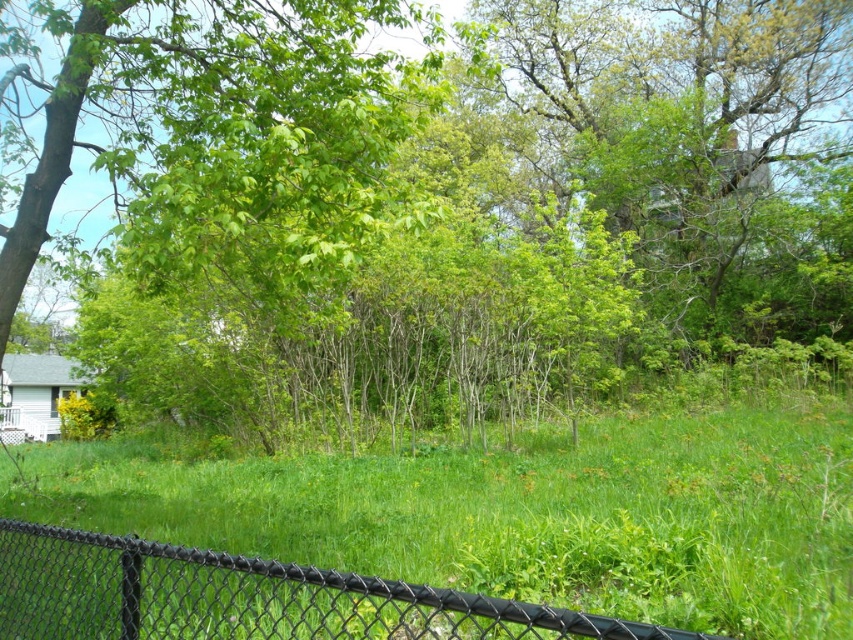
Can you confirm if green grassy at center is positioned to the left of black chain-link fence at lower center?

Yes, green grassy at center is to the left of black chain-link fence at lower center.

Is green grassy at center below black chain-link fence at lower center?

Yes, green grassy at center is below black chain-link fence at lower center.

Is point (225, 531) positioned behind point (715, 636)?

Yes, point (225, 531) is behind point (715, 636).

At what (x,y) coordinates should I click in order to perform the action: click on green grassy at center. Please return your answer as a coordinate pair (x, y). The image size is (853, 640). Looking at the image, I should click on (515, 513).

Is green leafy tree at center further to the viewer compared to black chain-link fence at lower center?

Yes, it is.

Between point (196, 356) and point (96, 586), which one is positioned behind?

Positioned behind is point (196, 356).

Which is behind, point (210, 232) or point (86, 554)?

Point (86, 554)

Locate an element on the screen. green leafy tree at center is located at coordinates (436, 204).

Does green leafy tree at center appear under green grassy at center?

No, green leafy tree at center is not below green grassy at center.

Can you confirm if green leafy tree at center is wider than green grassy at center?

Correct, the width of green leafy tree at center exceeds that of green grassy at center.

Find the location of a particular element. This screenshot has width=853, height=640. green leafy tree at center is located at coordinates click(x=436, y=204).